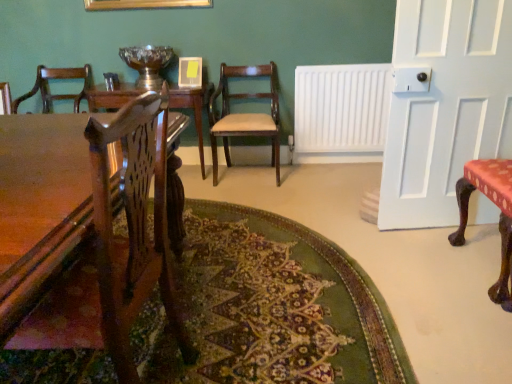
Locate an element on the screen. vacant point to the right of mahogany wood chair at center, the first chair when ordered from back to front is located at coordinates (307, 178).